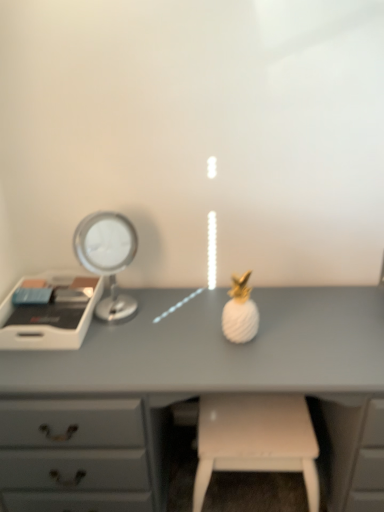
Image resolution: width=384 pixels, height=512 pixels. Identify the location of free space below silver metallic mirror at left (from a real-world perspective). (116, 312).